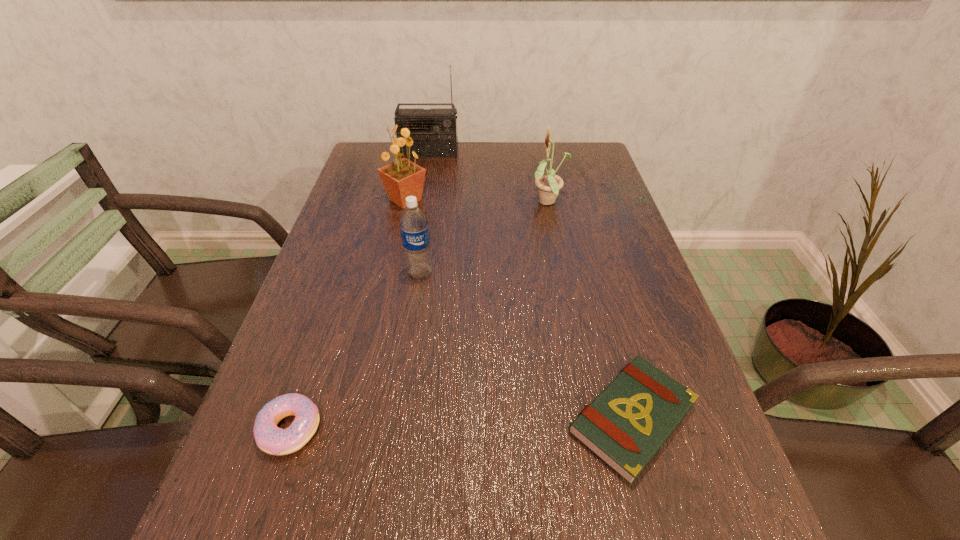
Identify the location of free space between the farthest object and the book. pyautogui.click(x=531, y=286).

This screenshot has height=540, width=960. I want to click on blank region between the right sunflower and the shortest object, so click(x=590, y=310).

Where is `vacant point located between the shortest object and the fourth farthest object`? This screenshot has height=540, width=960. vacant point located between the shortest object and the fourth farthest object is located at coordinates (526, 346).

Point out which object is positioned as the second nearest to the right sunflower. Please provide its 2D coordinates. Your answer should be formatted as a tuple, i.e. [(x, y)], where the tuple contains the x and y coordinates of a point satisfying the conditions above.

[(435, 133)]

Locate an element on the screen. The height and width of the screenshot is (540, 960). object that stands as the closest to the shortest object is located at coordinates (414, 228).

Where is `vacant space that satisfies the following two spatial constraints: 1. at the front of the book with flowers visible; 2. on the right side of the left sunflower`? vacant space that satisfies the following two spatial constraints: 1. at the front of the book with flowers visible; 2. on the right side of the left sunflower is located at coordinates (357, 418).

Find the location of a particular element. Image resolution: width=960 pixels, height=540 pixels. free point that satisfies the following two spatial constraints: 1. at the front of the left sunflower with flowers visible; 2. on the back side of the book is located at coordinates pos(357,418).

At what (x,y) coordinates should I click in order to perform the action: click on vacant space that satisfies the following two spatial constraints: 1. on the front panel of the radio receiver; 2. on the right side of the book. Please return your answer as a coordinate pair (x, y). The height and width of the screenshot is (540, 960). Looking at the image, I should click on 382,418.

Identify the location of free space that satisfies the following two spatial constraints: 1. at the front of the shortest object with flowers visible; 2. on the right side of the left sunflower. tap(357, 418).

Find the location of a particular element. Image resolution: width=960 pixels, height=540 pixels. free space that satisfies the following two spatial constraints: 1. on the front-facing side of the right sunflower; 2. on the right side of the book is located at coordinates (592, 418).